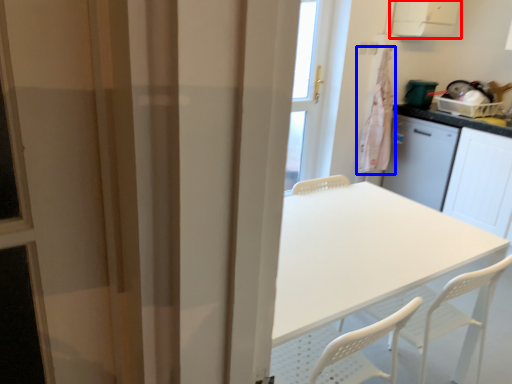
Question: Among these objects, which one is nearest to the camera, exhaust hood (highlighted by a red box) or laundry (highlighted by a blue box)?

Choices:
 (A) exhaust hood
 (B) laundry

Answer: (A)